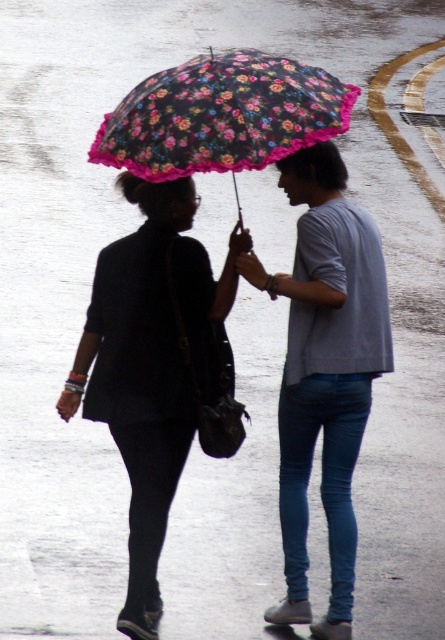
You are a fashion designer observing two people under an umbrella. You notice the matte black jacket at left and the light gray cotton shirt at center. Which clothing item is wider?

The matte black jacket at left is wider than the light gray cotton shirt at center, as its width surpasses the latter.

You are a photographer trying to capture the light gray cotton shirt at center in the image. The camera you are using has a focus point at coordinate point (324, 371). Will this focus point be effective for capturing the light gray cotton shirt at center?

Yes, the light gray cotton shirt at center is represented by point (324, 371), so the focus point at coordinate point (324, 371) will be effective for capturing the light gray cotton shirt at center.